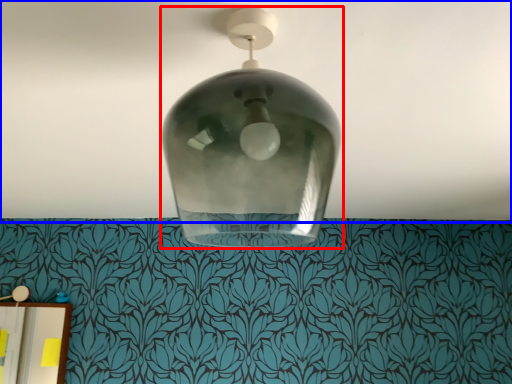
Question: Which of the following is the farthest to the observer, lamp (highlighted by a red box) or atmosphere (highlighted by a blue box)?

Choices:
 (A) lamp
 (B) atmosphere

Answer: (B)